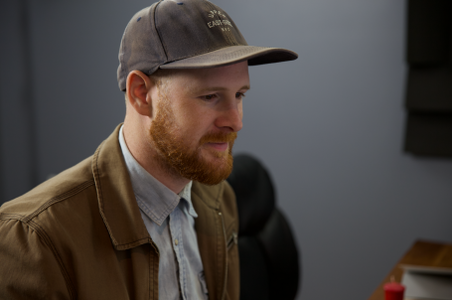
Locate an element on the screen. The height and width of the screenshot is (300, 452). notepad is located at coordinates (421, 282).